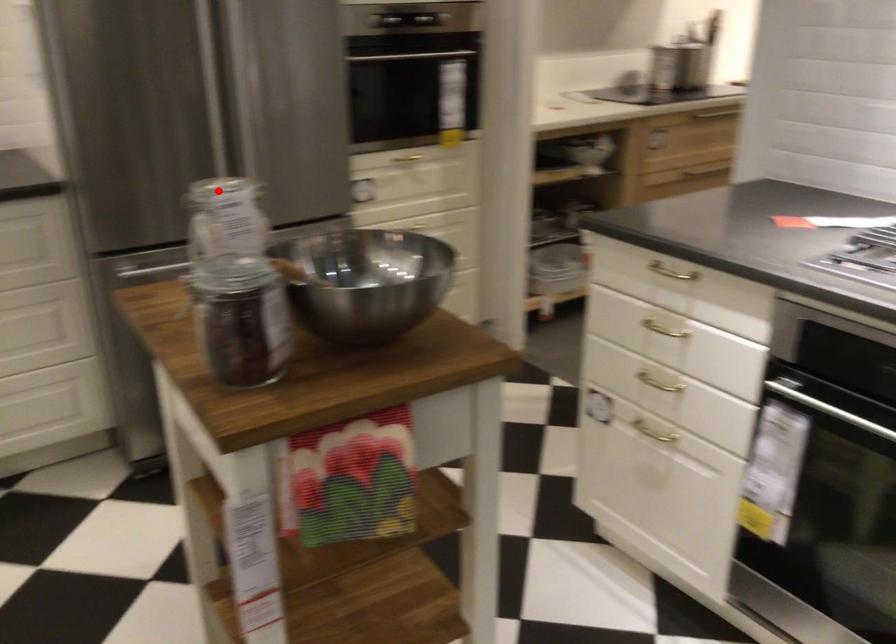
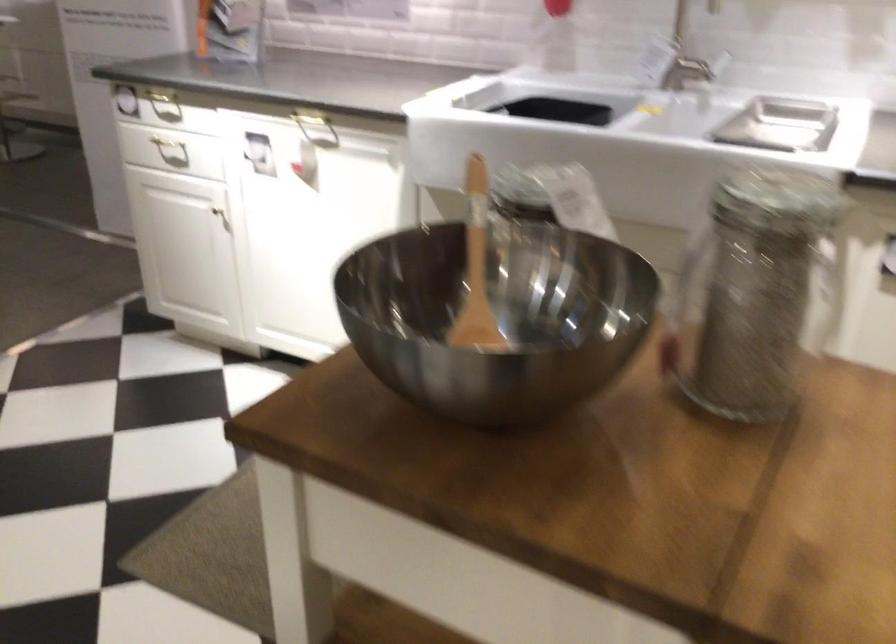
Question: I am providing you with two images of the same scene from different viewpoints. A red point is marked on the first image. At the location where the point appears in image 1, is it still visible in image 2?

Choices:
 (A) Yes
 (B) No

Answer: (B)